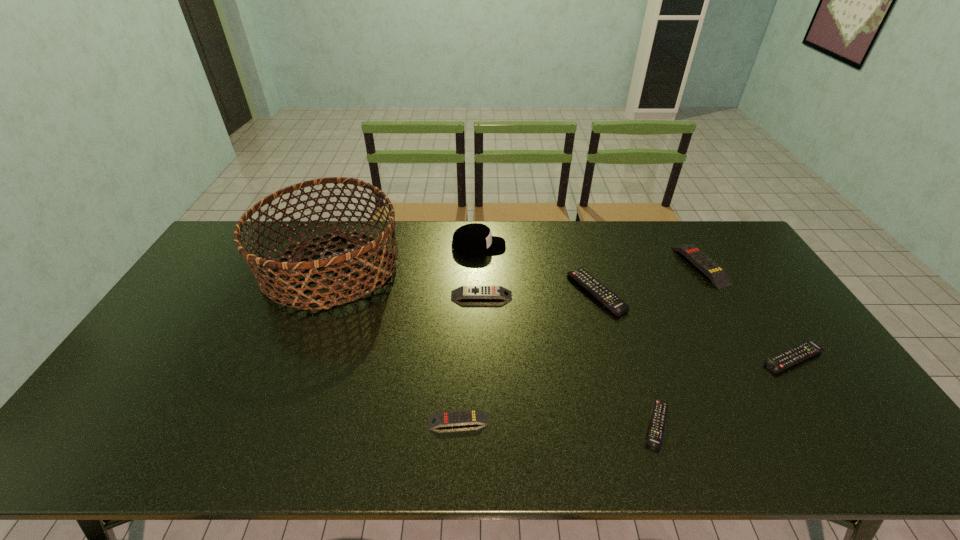
Image resolution: width=960 pixels, height=540 pixels. In order to click on free space that satisfies the following two spatial constraints: 1. on the front-facing side of the rightmost black remote control; 2. on the left side of the black cap in this screenshot , I will do `click(478, 358)`.

Identify the location of vacant area in the image that satisfies the following two spatial constraints: 1. on the front-facing side of the second farthest black remote control; 2. on the left side of the black cap. [x=478, y=358].

Identify the location of vacant point that satisfies the following two spatial constraints: 1. on the back side of the second biggest yellow remote control; 2. on the right side of the nearest yellow remote control. The image size is (960, 540). tap(464, 296).